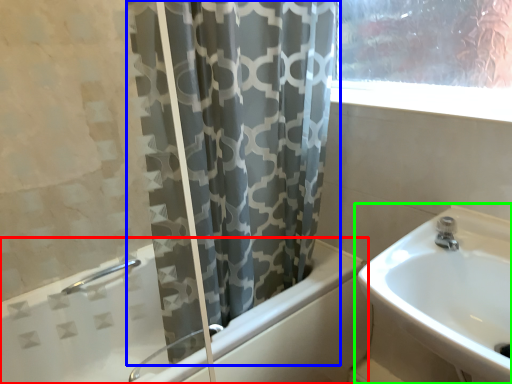
Question: Considering the real-world distances, which object is closest to bathtub (highlighted by a red box)? curtain (highlighted by a blue box) or sink (highlighted by a green box).

Choices:
 (A) curtain
 (B) sink

Answer: (A)